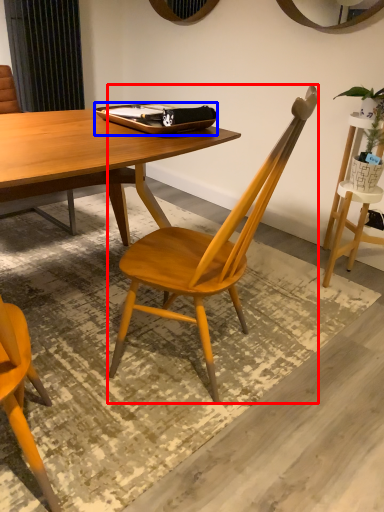
Question: Which object appears farthest to the camera in this image, chair (highlighted by a red box) or tray (highlighted by a blue box)?

Choices:
 (A) chair
 (B) tray

Answer: (B)